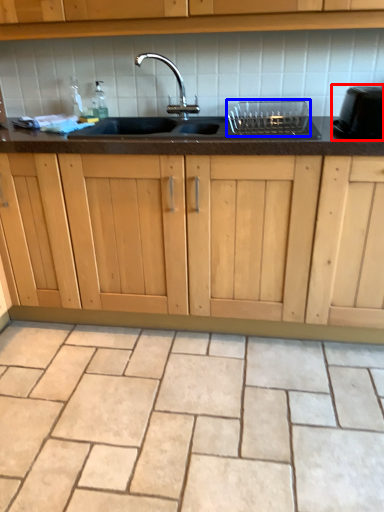
Question: Which object appears farthest to the camera in this image, appliance (highlighted by a red box) or appliance (highlighted by a blue box)?

Choices:
 (A) appliance
 (B) appliance

Answer: (B)